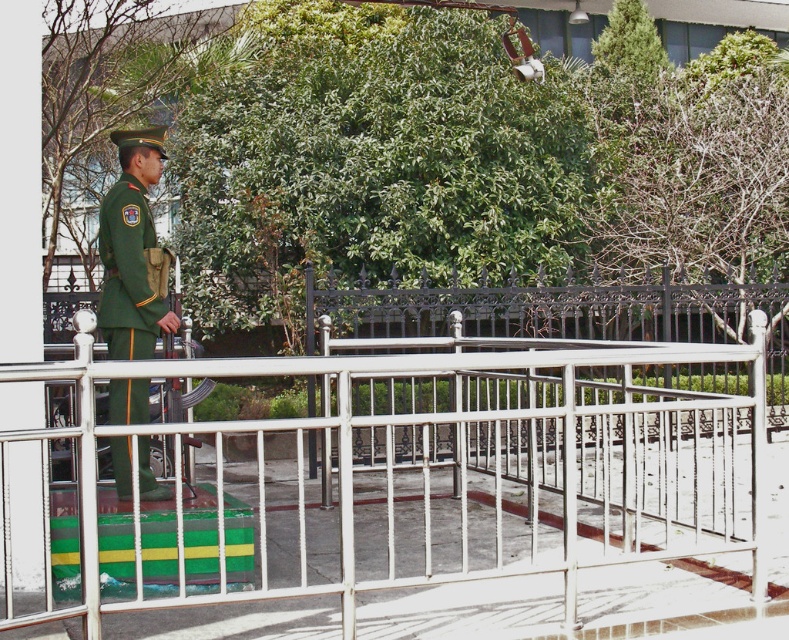
You are a soldier in the scene and need to step forward. Can you move past the white metal rail at center without stepping on the green matte uniform at left?

The white metal rail at center might be wider than green matte uniform at left, so you can move past the white metal rail at center by stepping to the side of it where the green matte uniform at left is not located.

You are a photographer positioned behind the soldier. You need to capture a photo that includes both the white metal rail at center and the green matte uniform at left. Based on their positions, which object should be placed on the right side of the photo frame?

The white metal rail at center should be placed on the right side of the photo frame because it is located to the right of the green matte uniform at left.